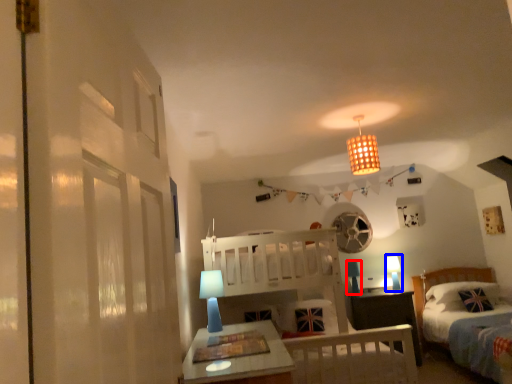
Question: Among these objects, which one is nearest to the camera, table lamp (highlighted by a red box) or table lamp (highlighted by a blue box)?

Choices:
 (A) table lamp
 (B) table lamp

Answer: (A)